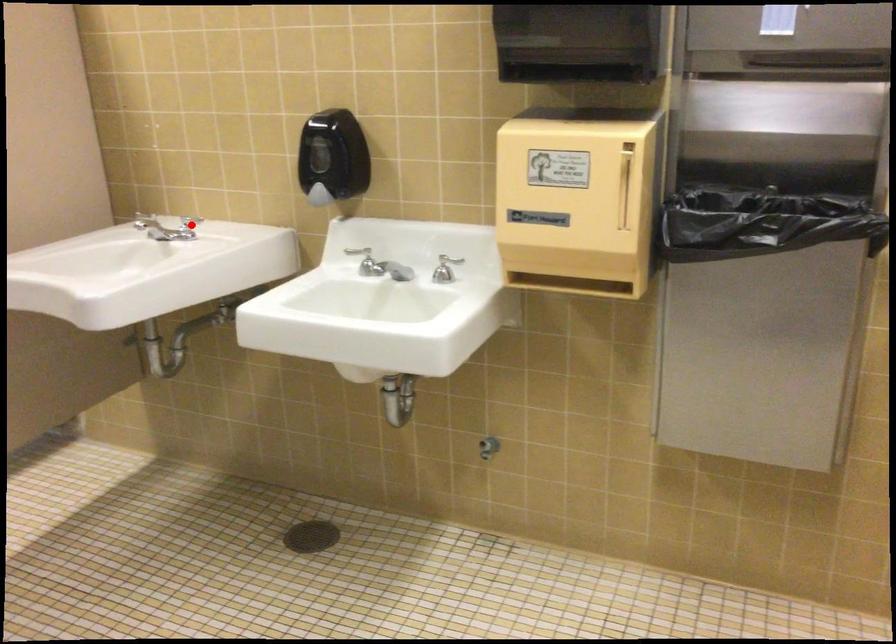
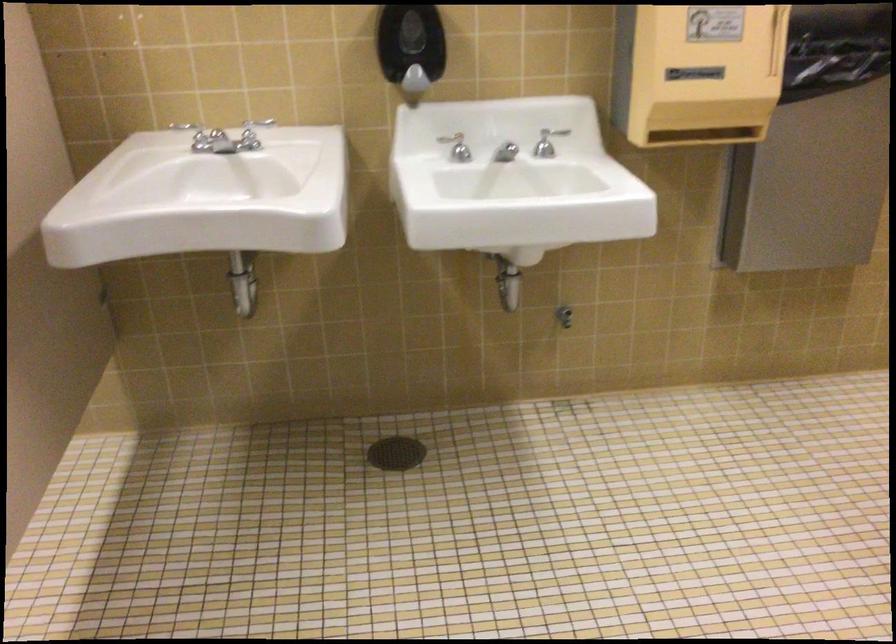
Question: I am providing you with two images of the same scene from different viewpoints. Given a red point in image1, look at the same physical point in image2. Is it:

Choices:
 (A) Closer to the viewpoint
 (B) Farther from the viewpoint

Answer: (A)